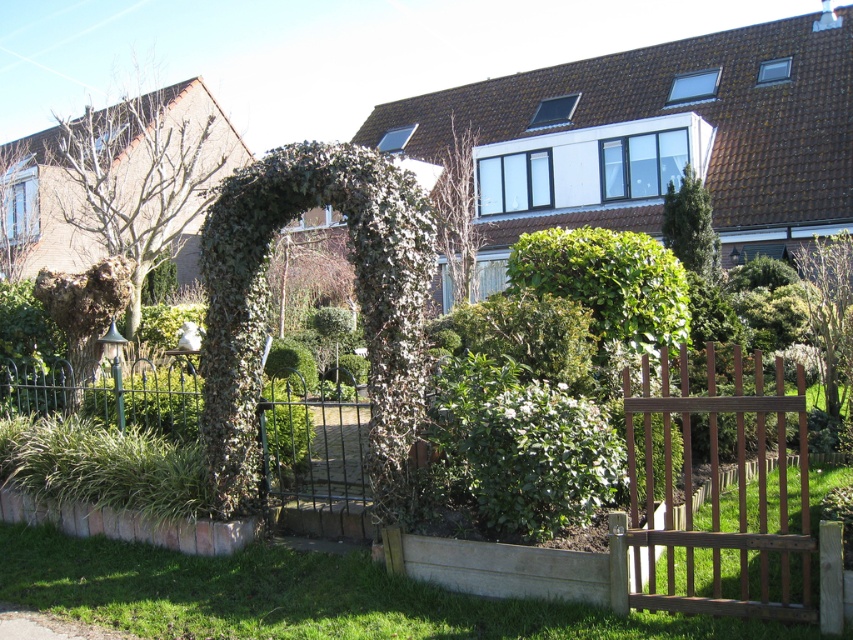
Does green leafy bush at center have a greater width compared to green leafy tree at upper left?

No.

Between point (490, 417) and point (1, 209), which one is positioned behind?

Point (1, 209)

This screenshot has height=640, width=853. What do you see at coordinates (517, 451) in the screenshot?
I see `green leafy bush at center` at bounding box center [517, 451].

Identify the location of green leafy bush at center. The height and width of the screenshot is (640, 853). (517, 451).

Is the position of green ivy-covered arch at center more distant than that of green leafy tree at upper right?

No, green ivy-covered arch at center is in front of green leafy tree at upper right.

Who is positioned more to the left, green ivy-covered arch at center or green leafy tree at upper right?

green ivy-covered arch at center is more to the left.

Does point (421, 225) come closer to viewer compared to point (688, 227)?

Yes, it is.

This screenshot has height=640, width=853. What are the coordinates of `green ivy-covered arch at center` in the screenshot? It's located at (357, 298).

Who is more forward, [627,392] or [134,195]?

Point [627,392] is more forward.

Between point (711, 353) and point (62, 204), which one is positioned behind?

The point (62, 204) is more distant.

This screenshot has width=853, height=640. Identify the location of brown wooden gate at lower right. (718, 496).